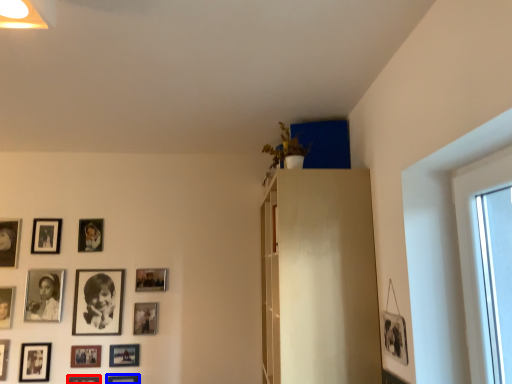
Question: Which point is closer to the camera, picture frame (highlighted by a red box) or picture frame (highlighted by a blue box)?

Choices:
 (A) picture frame
 (B) picture frame

Answer: (A)